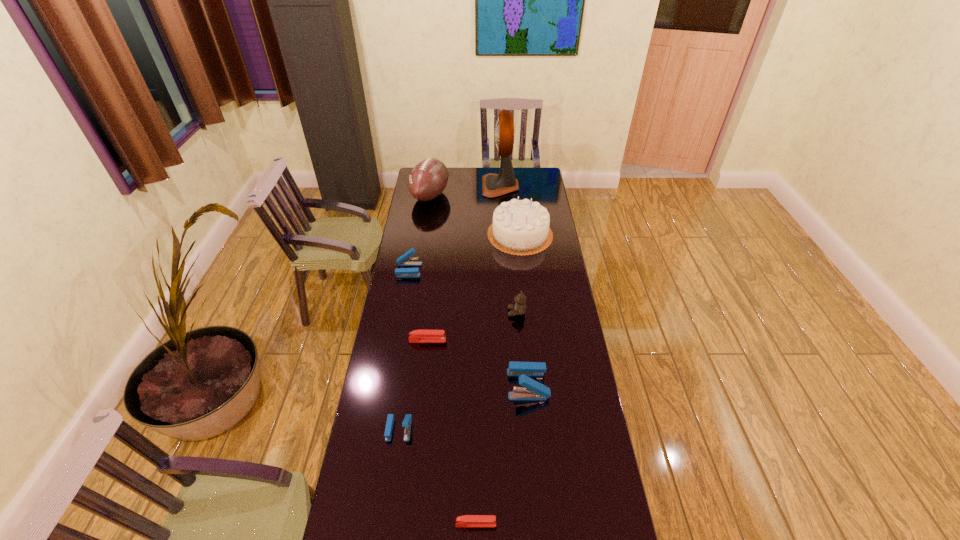
This screenshot has width=960, height=540. Find the location of `blue stapler that stands as the closest to the football (American)`. blue stapler that stands as the closest to the football (American) is located at coordinates (403, 260).

Identify which red stapler is the closest to the brown teddy bear. Please provide its 2D coordinates. Your answer should be formatted as a tuple, i.e. [(x, y)], where the tuple contains the x and y coordinates of a point satisfying the conditions above.

[(417, 336)]

At what (x,y) coordinates should I click in order to perform the action: click on vacant point that satisfies the following two spatial constraints: 1. on the front-facing side of the tallest object; 2. on the front side of the seventh tallest object. Please return your answer as a coordinate pair (x, y). The width and height of the screenshot is (960, 540). Looking at the image, I should click on (516, 429).